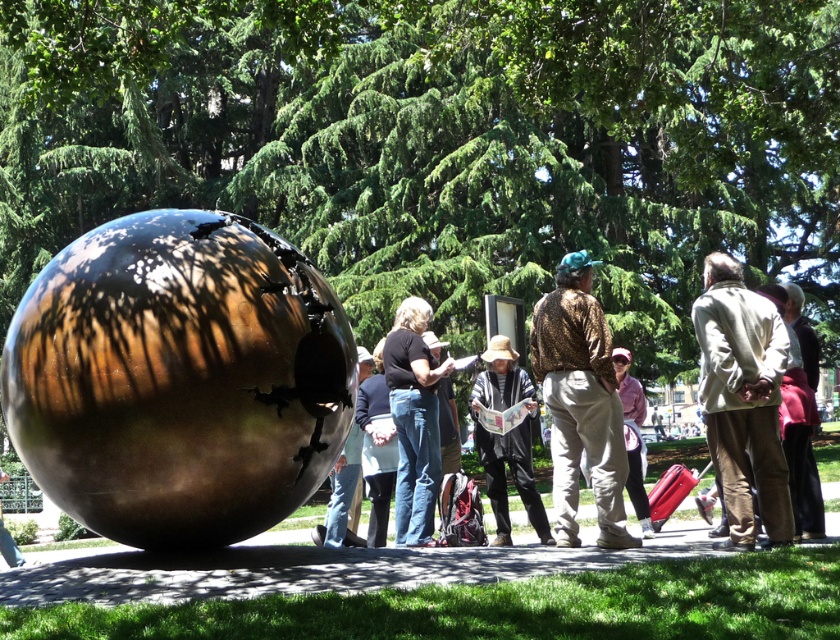
Question: Estimate the real-world distances between objects in this image. Which object is farther from the shiny metallic sphere at center?

Choices:
 (A) leopard print shirt at center
 (B) black matte shirt at center
 (C) matte black shirt at center
 (D) light beige jacket at right

Answer: (D)

Question: From the image, what is the correct spatial relationship of leopard print shirt at center in relation to matte black shirt at center?

Choices:
 (A) above
 (B) below

Answer: (A)

Question: Is light beige jacket at right positioned at the back of striped sweater at center?

Choices:
 (A) yes
 (B) no

Answer: (B)

Question: Which is nearer to the leopard print shirt at center?

Choices:
 (A) striped sweater at center
 (B) light beige jacket at right

Answer: (B)

Question: Does striped sweater at center come behind matte black shirt at center?

Choices:
 (A) yes
 (B) no

Answer: (A)

Question: Among these points, which one is farthest from the camera?

Choices:
 (A) (345, 454)
 (B) (609, 412)
 (C) (507, 404)
 (D) (747, 378)

Answer: (C)